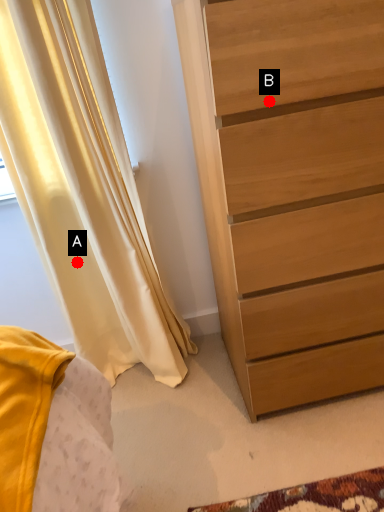
Question: Two points are circled on the image, labeled by A and B beside each circle. Which point is farther from the camera taking this photo?

Choices:
 (A) A is further
 (B) B is further

Answer: (A)